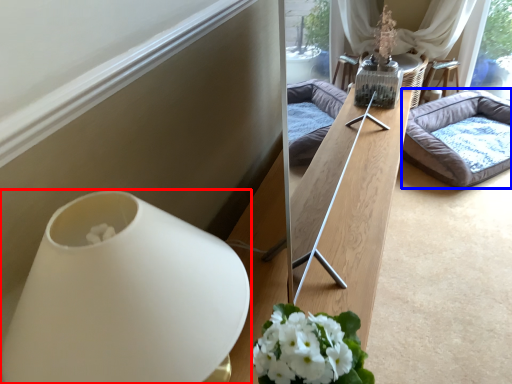
Question: Which object is further to the camera taking this photo, vase (highlighted by a red box) or studio couch (highlighted by a blue box)?

Choices:
 (A) vase
 (B) studio couch

Answer: (B)